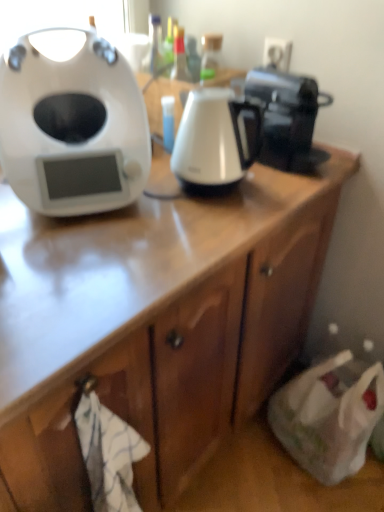
Question: Is white glossy electric kettle at center with white matte/soft plastic at left?

Choices:
 (A) yes
 (B) no

Answer: (B)

Question: Is white glossy electric kettle at center wider than white matte/soft plastic at left?

Choices:
 (A) yes
 (B) no

Answer: (B)

Question: Is white glossy electric kettle at center located outside white matte/soft plastic at left?

Choices:
 (A) yes
 (B) no

Answer: (A)

Question: From a real-world perspective, is white glossy electric kettle at center physically below white matte/soft plastic at left?

Choices:
 (A) yes
 (B) no

Answer: (A)

Question: Does white glossy electric kettle at center contain white matte/soft plastic at left?

Choices:
 (A) no
 (B) yes

Answer: (A)

Question: Considering the relative sizes of white glossy electric kettle at center and white matte/soft plastic at left in the image provided, is white glossy electric kettle at center bigger than white matte/soft plastic at left?

Choices:
 (A) no
 (B) yes

Answer: (A)

Question: Is black glossy coffee maker at upper right far away from white matte/soft plastic at left?

Choices:
 (A) no
 (B) yes

Answer: (A)

Question: Considering the relative sizes of black glossy coffee maker at upper right and white matte/soft plastic at left in the image provided, is black glossy coffee maker at upper right wider than white matte/soft plastic at left?

Choices:
 (A) yes
 (B) no

Answer: (A)

Question: Does black glossy coffee maker at upper right lie in front of white matte/soft plastic at left?

Choices:
 (A) no
 (B) yes

Answer: (A)

Question: Is black glossy coffee maker at upper right oriented away from white matte/soft plastic at left?

Choices:
 (A) yes
 (B) no

Answer: (B)

Question: From a real-world perspective, is black glossy coffee maker at upper right physically above white matte/soft plastic at left?

Choices:
 (A) no
 (B) yes

Answer: (A)

Question: Does black glossy coffee maker at upper right have a larger size compared to white matte/soft plastic at left?

Choices:
 (A) yes
 (B) no

Answer: (B)

Question: Considering the relative sizes of black glossy coffee maker at upper right and white glossy electric kettle at center in the image provided, is black glossy coffee maker at upper right shorter than white glossy electric kettle at center?

Choices:
 (A) no
 (B) yes

Answer: (B)